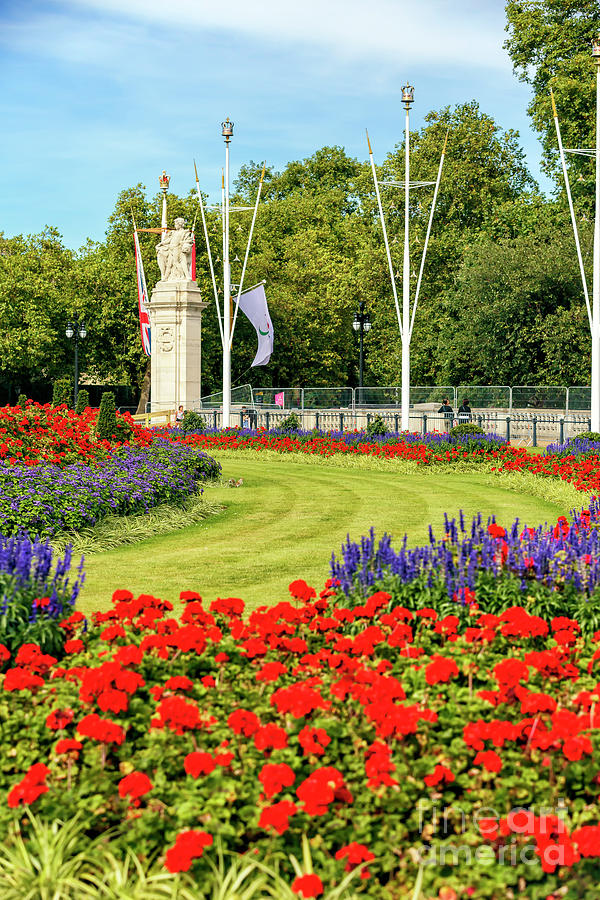
The height and width of the screenshot is (900, 600). Identify the location of light. (69, 334), (85, 331), (356, 325), (368, 327).